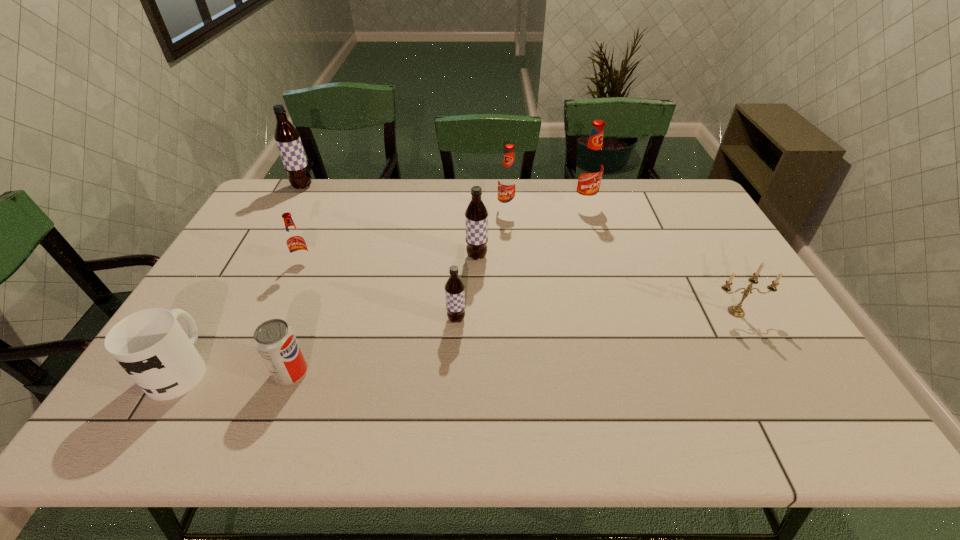
Find the location of `the nearest brown root beer`. the nearest brown root beer is located at coordinates (454, 288).

Image resolution: width=960 pixels, height=540 pixels. What are the coordinates of `candle` in the screenshot? It's located at (735, 310).

At what (x,y) coordinates should I click in order to perform the action: click on metallic candle. Please return your answer as a coordinate pair (x, y). Looking at the image, I should click on (735, 310).

Find the location of a particular element. mug is located at coordinates (150, 345).

Find the location of a particular element. The height and width of the screenshot is (540, 960). the sixth object from right to left is located at coordinates (274, 339).

The image size is (960, 540). Find the location of `vacant space located 0.260m on the front of the farthest root beer`. vacant space located 0.260m on the front of the farthest root beer is located at coordinates (275, 236).

The image size is (960, 540). What are the coordinates of `vacant region located on the back of the rightmost red root beer` in the screenshot? It's located at (576, 179).

At what (x,y) coordinates should I click in order to perform the action: click on vacant space located 0.320m on the left of the second root beer from right to left. Please return your answer as a coordinate pair (x, y). The image size is (960, 540). Looking at the image, I should click on (404, 210).

Identify the location of vacant space situated 0.380m on the right of the second smallest brown root beer. This screenshot has height=540, width=960. point(612,256).

You are a GUI agent. You are given a task and a screenshot of the screen. Output one action in this format:
    pyautogui.click(x=<x>, y=<y>)
    Task: Click on the free space located on the back of the leftmost red root beer
    
    Given the screenshot: What is the action you would take?
    pyautogui.click(x=331, y=202)